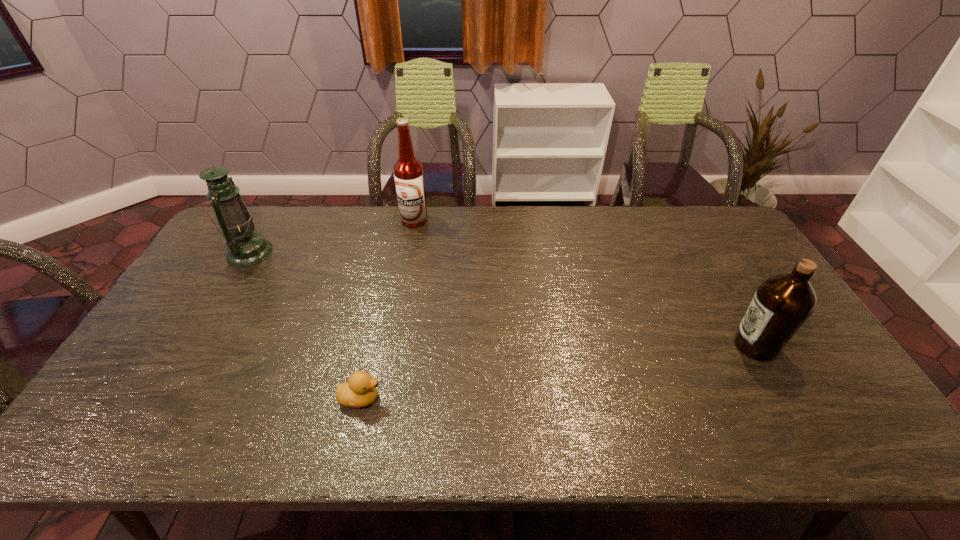
You are a GUI agent. You are given a task and a screenshot of the screen. Output one action in this format:
    pyautogui.click(x=<x>, y=<y>)
    Task: Click on the empty space between the farthest object and the shortest object
    The width and height of the screenshot is (960, 540).
    Given the screenshot: What is the action you would take?
    pyautogui.click(x=388, y=309)

Locate an element on the screen. unoccupied area between the third farthest object and the alcohol is located at coordinates (585, 283).

In order to click on object that is the second nearest to the third nearest object in this screenshot , I will do `click(360, 390)`.

In order to click on object that ranks as the third closest to the third farthest object in this screenshot , I will do `click(245, 248)`.

Find the location of `vacant space that satisfies the following two spatial constraints: 1. on the label side of the alcohol; 2. facing forward on the duckling`. vacant space that satisfies the following two spatial constraints: 1. on the label side of the alcohol; 2. facing forward on the duckling is located at coordinates tap(381, 398).

Locate an element on the screen. This screenshot has height=540, width=960. free location that satisfies the following two spatial constraints: 1. on the label side of the farthest object; 2. facing forward on the nearest object is located at coordinates (381, 398).